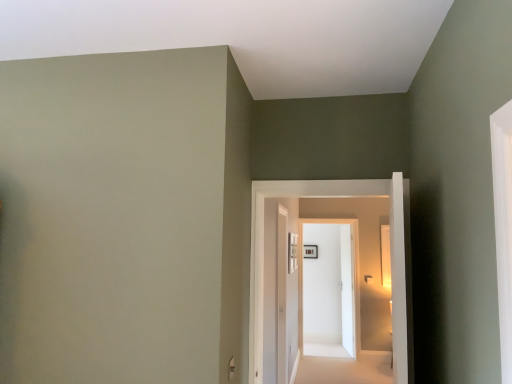
Question: Which direction should I rotate to face white glossy door at center, acting as the 1th door starting from the left, — up or down?

Choices:
 (A) up
 (B) down

Answer: (B)

Question: Is white glossy door at center, which appears as the 1th door when viewed from the back, shorter than white glossy door at center, the second door positioned from the right?

Choices:
 (A) no
 (B) yes

Answer: (A)

Question: Is white glossy door at center, which is the second door from front to back, touching white glossy door at center, which appears as the second door when viewed from the back?

Choices:
 (A) no
 (B) yes

Answer: (A)

Question: Is white glossy door at center, which appears as the 1th door when viewed from the back, at the left side of white glossy door at center, which appears as the second door when viewed from the back?

Choices:
 (A) yes
 (B) no

Answer: (B)

Question: Is white glossy door at center, the 2th door viewed from the left, facing towards white glossy door at center, which appears as the 1th door when viewed from the front?

Choices:
 (A) no
 (B) yes

Answer: (B)

Question: Considering the relative sizes of white glossy door at center, which appears as the 1th door when viewed from the back, and white glossy door at center, which appears as the 1th door when viewed from the front, in the image provided, is white glossy door at center, which appears as the 1th door when viewed from the back, thinner than white glossy door at center, which appears as the 1th door when viewed from the front,?

Choices:
 (A) yes
 (B) no

Answer: (A)

Question: From the image's perspective, is white glossy door at center, the 2th door viewed from the left, located above white glossy door at center, which appears as the 1th door when viewed from the front?

Choices:
 (A) no
 (B) yes

Answer: (A)

Question: Is white carpet at center not close to white glossy door at center, acting as the 1th door starting from the left?

Choices:
 (A) yes
 (B) no

Answer: (A)

Question: From a real-world perspective, is white carpet at center positioned over white glossy door at center, which appears as the 1th door when viewed from the front, based on gravity?

Choices:
 (A) no
 (B) yes

Answer: (A)

Question: Is white glossy door at center, which appears as the 1th door when viewed from the front, a part of white carpet at center?

Choices:
 (A) yes
 (B) no

Answer: (B)

Question: From the image's perspective, does white carpet at center appear lower than white glossy door at center, which appears as the 1th door when viewed from the front?

Choices:
 (A) yes
 (B) no

Answer: (A)

Question: Can you confirm if white carpet at center is shorter than white glossy door at center, which appears as the 1th door when viewed from the front?

Choices:
 (A) yes
 (B) no

Answer: (A)

Question: Is white glossy door at center, acting as the 1th door starting from the left, at the back of white carpet at center?

Choices:
 (A) yes
 (B) no

Answer: (B)

Question: Is white glossy door at center, which appears as the 1th door when viewed from the back, positioned with its back to wooden picture frame at center?

Choices:
 (A) no
 (B) yes

Answer: (B)